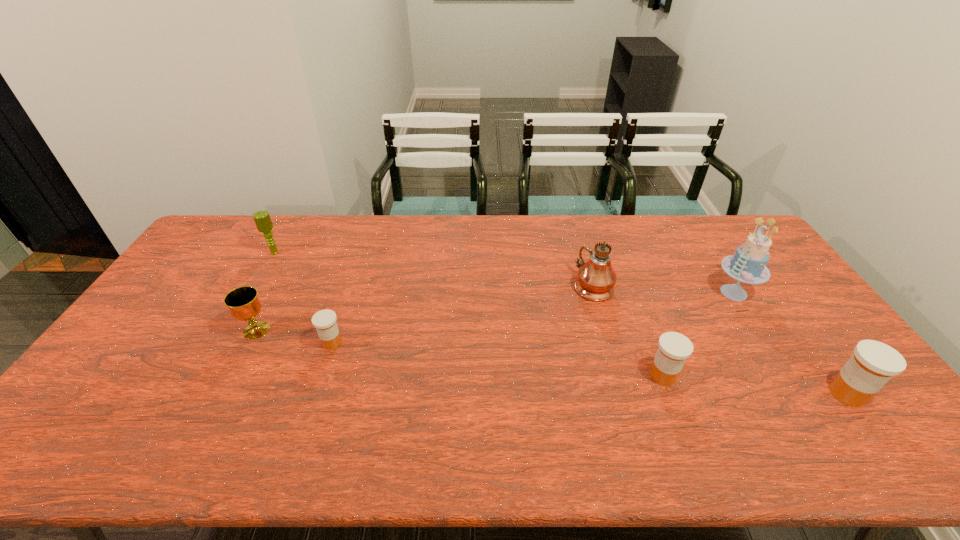
This screenshot has width=960, height=540. Find the location of `the farthest medicine`. the farthest medicine is located at coordinates (324, 321).

This screenshot has height=540, width=960. I want to click on the fifth object from right to left, so click(324, 321).

Where is `the second shortest medicine`? The height and width of the screenshot is (540, 960). the second shortest medicine is located at coordinates (674, 348).

Find the location of a particular element. The width and height of the screenshot is (960, 540). the second medicine from right to left is located at coordinates (674, 348).

Find the location of `the rightmost medicine`. the rightmost medicine is located at coordinates (873, 364).

At what (x,y) coordinates should I click in order to perform the action: click on the tallest medicine. Please return your answer as a coordinate pair (x, y). This screenshot has width=960, height=540. Looking at the image, I should click on (873, 364).

Image resolution: width=960 pixels, height=540 pixels. In order to click on microphone in this screenshot , I will do click(262, 219).

You are a GUI agent. You are given a task and a screenshot of the screen. Output one action in this format:
    pyautogui.click(x=<x>, y=<y>)
    Task: Click on the leftmost object
    The image size is (960, 540).
    Given the screenshot: What is the action you would take?
    pyautogui.click(x=262, y=219)

The width and height of the screenshot is (960, 540). I want to click on the sixth object from right to left, so 243,302.

The width and height of the screenshot is (960, 540). What are the coordinates of `the sixth object from left to right` in the screenshot? It's located at (748, 264).